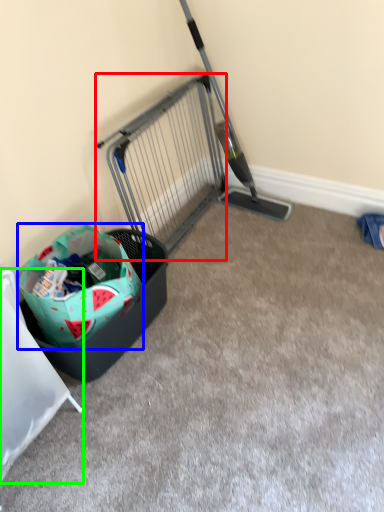
Question: Based on their relative distances, which object is farther from cage (highlighted by a red box)? Choose from shopping bag (highlighted by a blue box) and furniture (highlighted by a green box).

Choices:
 (A) shopping bag
 (B) furniture

Answer: (B)